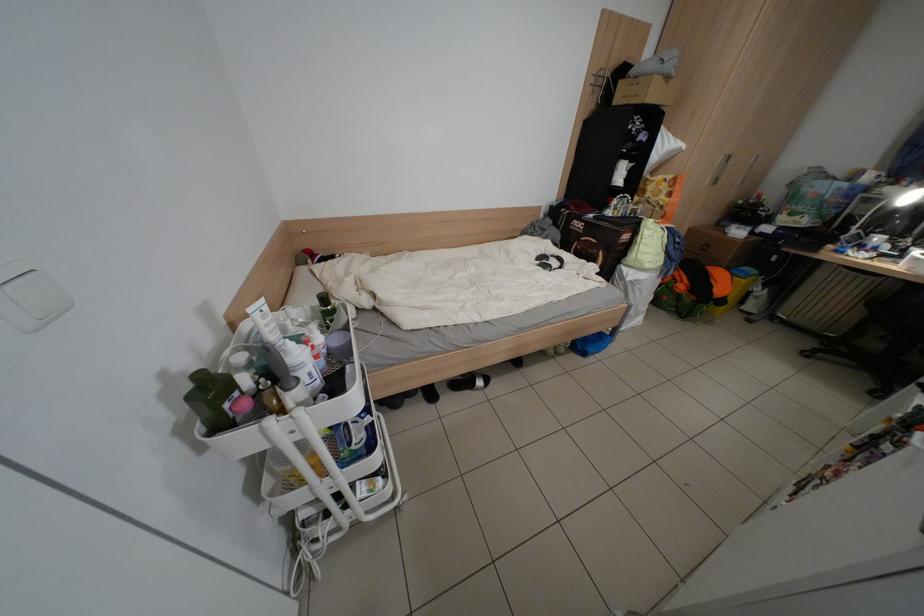
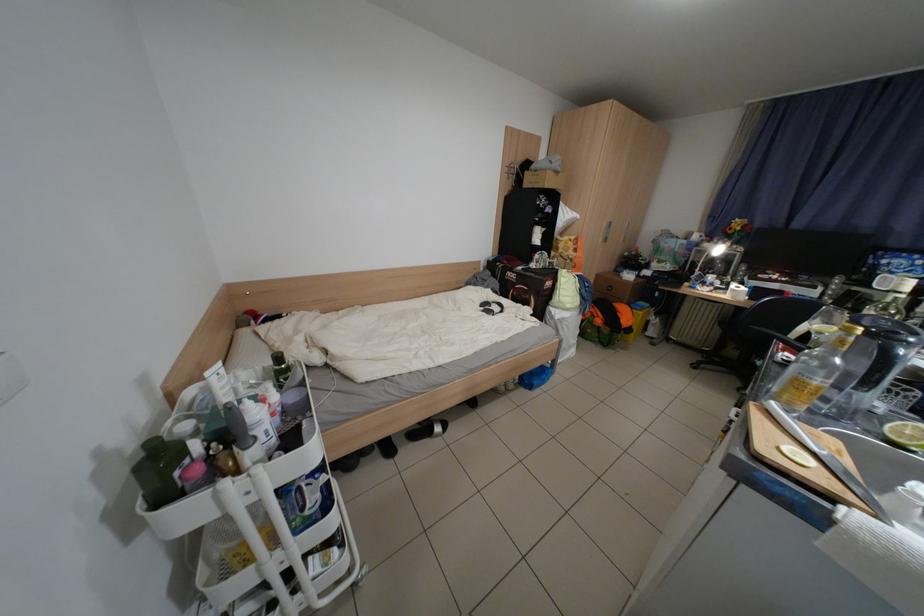
Find the pixel in the second image that matches point 268,317 in the first image.

(225, 379)